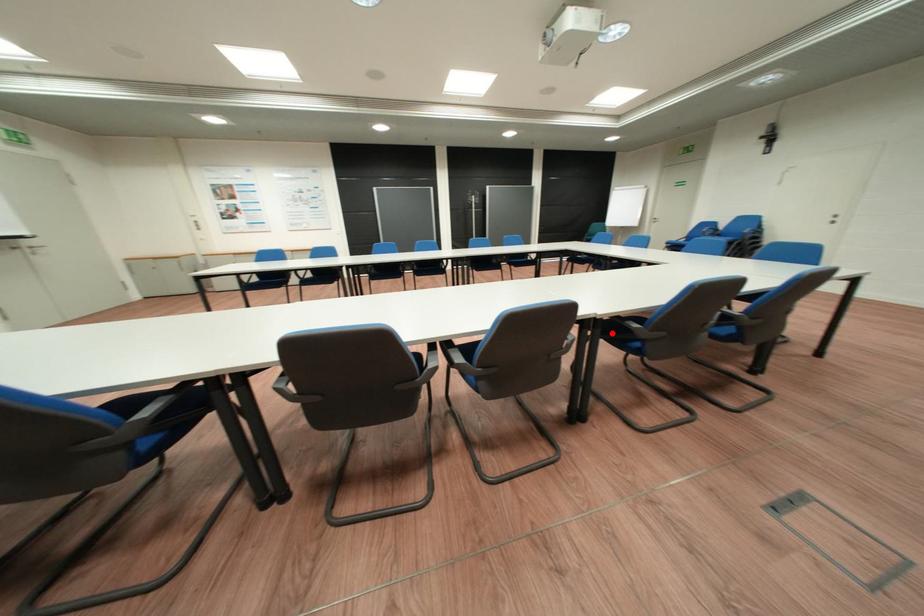
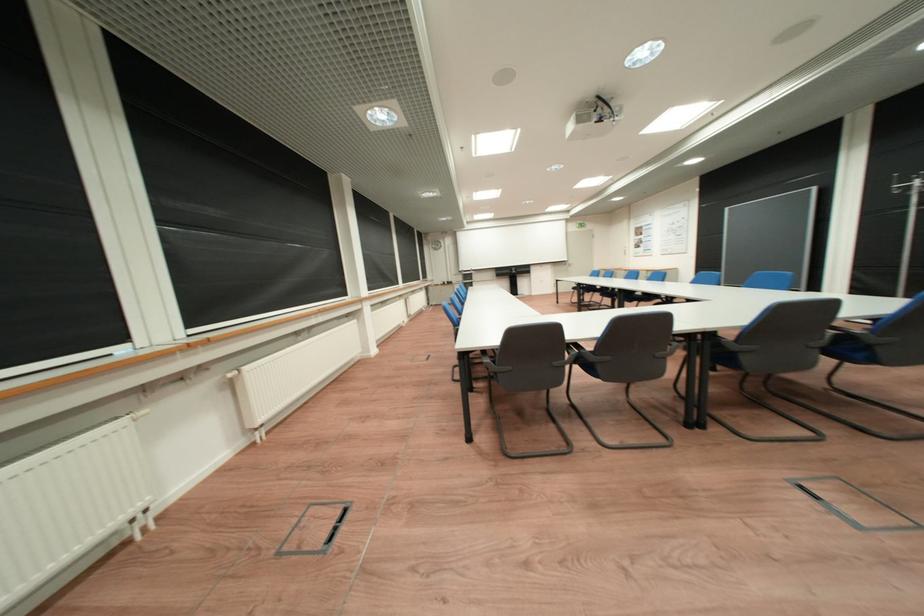
Question: I am providing you with two images of the same scene from different viewpoints. A red point is marked on the first image. Can you still see the location of the red point in image 2?

Choices:
 (A) Yes
 (B) No

Answer: (B)